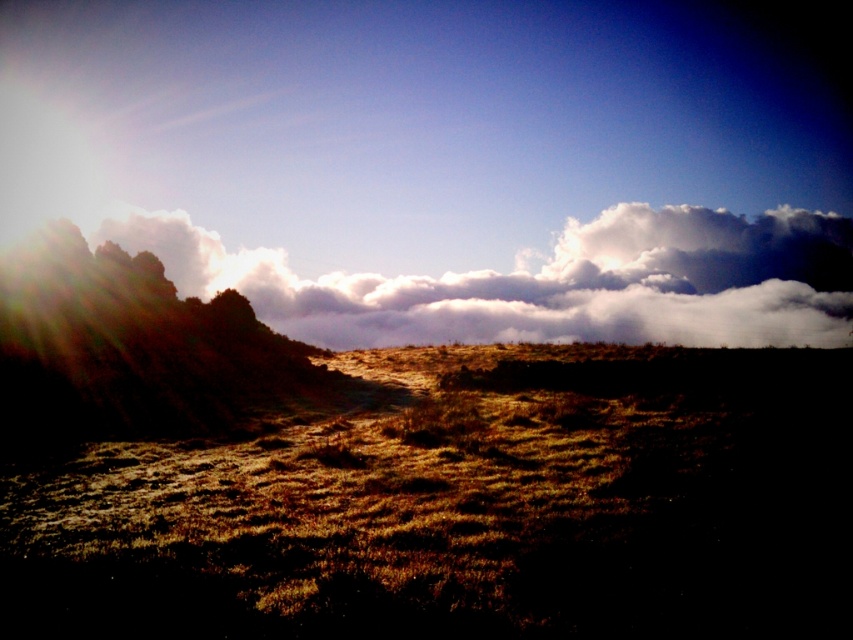
Question: Which point is farther to the camera?

Choices:
 (A) (186, 243)
 (B) (403, 493)

Answer: (A)

Question: From the image, what is the correct spatial relationship of brown textured grass at center in relation to white fluffy cloud at upper center?

Choices:
 (A) right
 (B) left

Answer: (B)

Question: Where is brown textured grass at center located in relation to white fluffy cloud at upper center in the image?

Choices:
 (A) right
 (B) left

Answer: (B)

Question: Among these points, which one is nearest to the camera?

Choices:
 (A) pos(258,440)
 (B) pos(480,292)

Answer: (A)

Question: Is brown textured grass at center below white fluffy cloud at upper center?

Choices:
 (A) no
 (B) yes

Answer: (B)

Question: Which object appears closest to the camera in this image?

Choices:
 (A) brown textured grass at center
 (B) white fluffy cloud at upper center

Answer: (A)